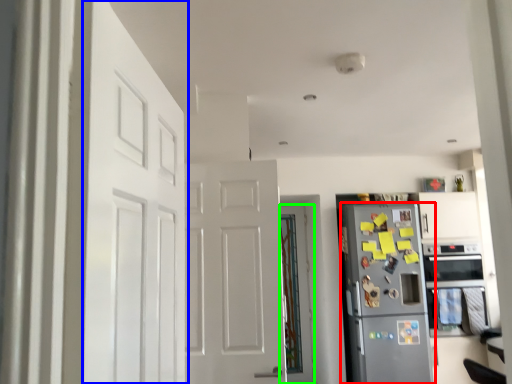
Question: Which is farther away from refrigerator (highlighted by a red box)? door (highlighted by a blue box) or door (highlighted by a green box)?

Choices:
 (A) door
 (B) door

Answer: (A)